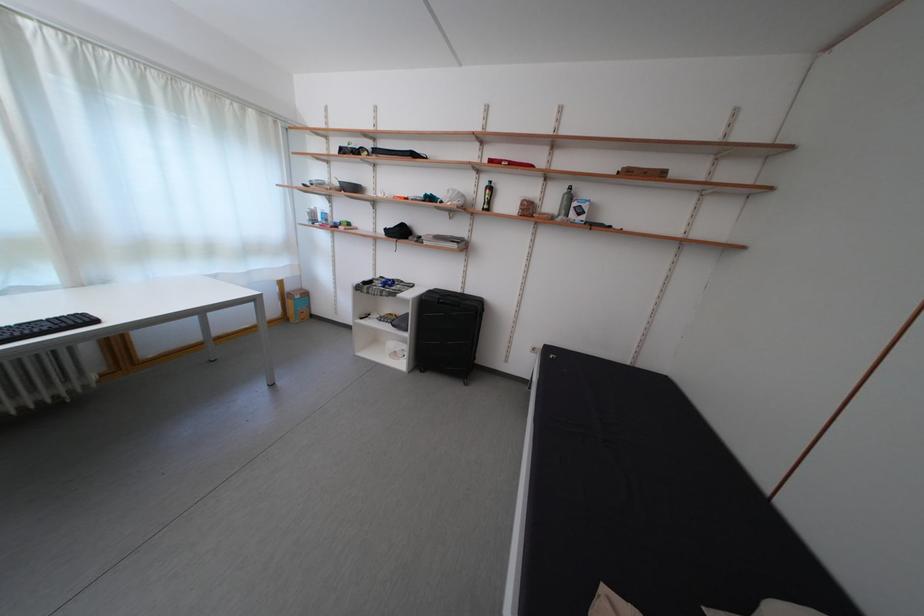
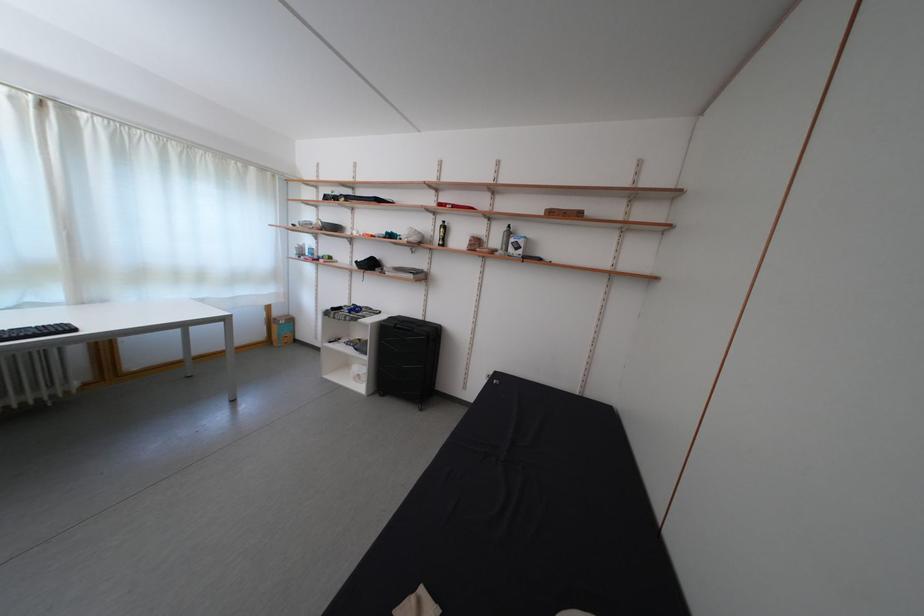
Where in the second image is the point corresponding to [298,294] from the first image?

(285, 320)